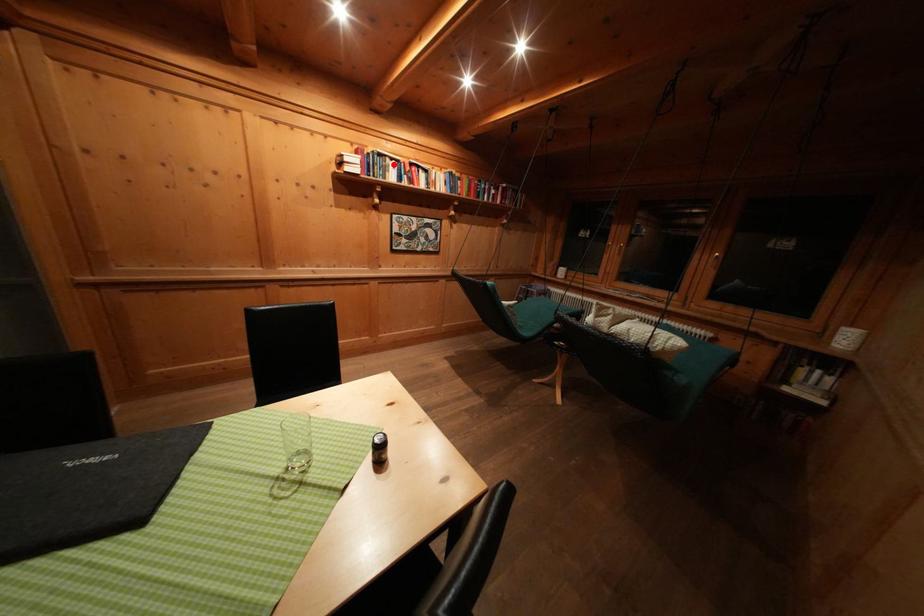
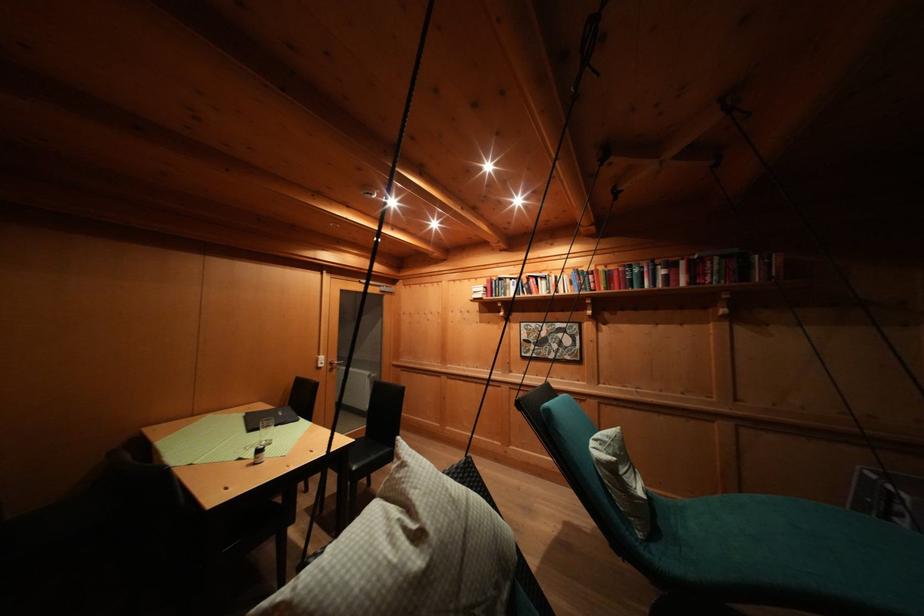
Question: I am providing you with two images of the same scene from different viewpoints. A red point is marked on the first image. Can you still see the location of the red point in image 2?

Choices:
 (A) Yes
 (B) No

Answer: (A)